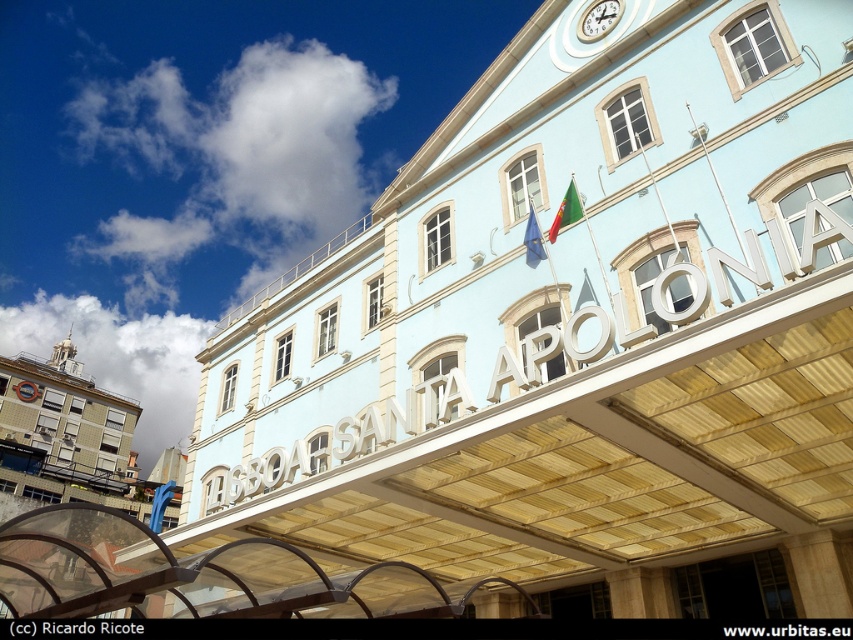
Image resolution: width=853 pixels, height=640 pixels. What do you see at coordinates (566, 211) in the screenshot?
I see `green fabric flag at upper center` at bounding box center [566, 211].

Is green fabric flag at upper center above european union flag at center?

Yes.

Describe the element at coordinates (566, 211) in the screenshot. I see `green fabric flag at upper center` at that location.

I want to click on green fabric flag at upper center, so click(566, 211).

Does white glossy clock at upper center have a lesser width compared to european union flag at center?

In fact, white glossy clock at upper center might be wider than european union flag at center.

Can you confirm if white glossy clock at upper center is positioned above european union flag at center?

Indeed, white glossy clock at upper center is positioned over european union flag at center.

Identify the location of white glossy clock at upper center. (598, 19).

Is brick building at lower left below european union flag at center?

Correct, brick building at lower left is located below european union flag at center.

Which is above, brick building at lower left or european union flag at center?

european union flag at center

Is point (83, 422) in front of point (535, 230)?

No, it is behind (535, 230).

Identify the location of brick building at lower left. The height and width of the screenshot is (640, 853). (65, 435).